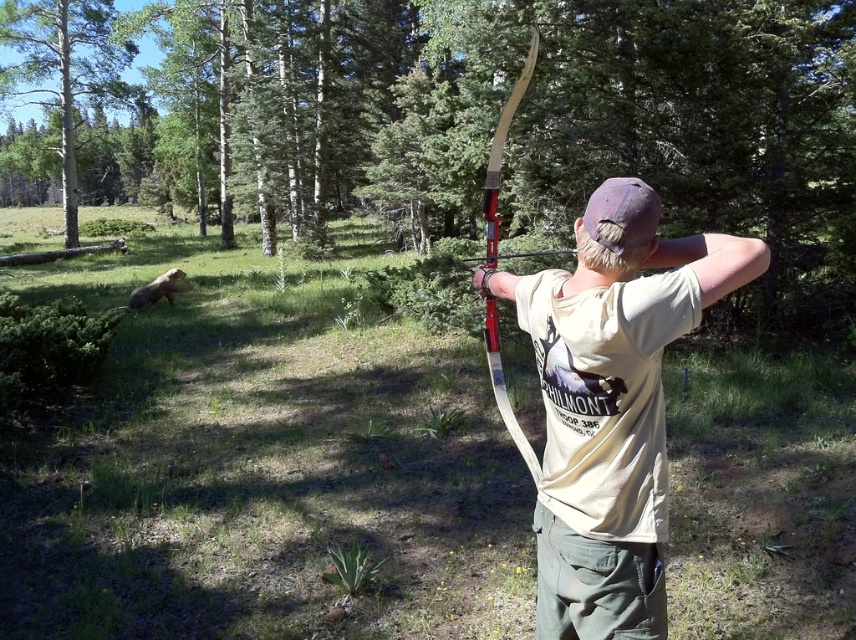
Is matte khaki shirt at center below wooden bow at center?

Yes.

Who is taller, matte khaki shirt at center or wooden bow at center?

matte khaki shirt at center is taller.

Is point (645, 198) farther from camera compared to point (536, 35)?

No, (645, 198) is closer to viewer.

This screenshot has height=640, width=856. In order to click on matte khaki shirt at center in this screenshot , I will do `click(611, 404)`.

Can you confirm if green leafy tree at center is positioned to the right of matte khaki shirt at center?

A: Incorrect, green leafy tree at center is not on the right side of matte khaki shirt at center.

In the scene shown: Between green leafy tree at center and matte khaki shirt at center, which one is positioned lower?

matte khaki shirt at center is below.

Where is `green leafy tree at center`? The image size is (856, 640). green leafy tree at center is located at coordinates (518, 120).

Where is `green leafy tree at left`? The width and height of the screenshot is (856, 640). green leafy tree at left is located at coordinates (62, 68).

This screenshot has width=856, height=640. What do you see at coordinates (62, 68) in the screenshot?
I see `green leafy tree at left` at bounding box center [62, 68].

You are a GUI agent. You are given a task and a screenshot of the screen. Output one action in this format:
    pyautogui.click(x=<x>, y=<y>)
    Task: Click on the green leafy tree at left
    The height and width of the screenshot is (640, 856).
    Given the screenshot: What is the action you would take?
    pyautogui.click(x=62, y=68)